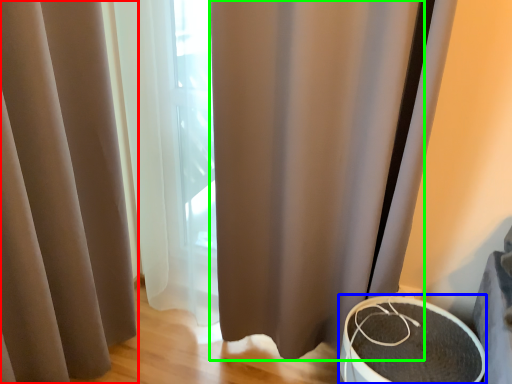
Question: Considering the real-world distances, which object is farthest from curtain (highlighted by a red box)? round table (highlighted by a blue box) or shower curtain (highlighted by a green box)?

Choices:
 (A) round table
 (B) shower curtain

Answer: (A)